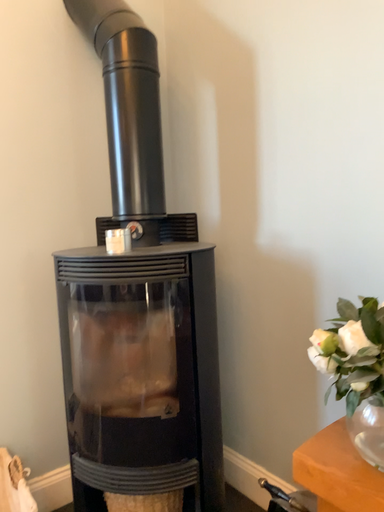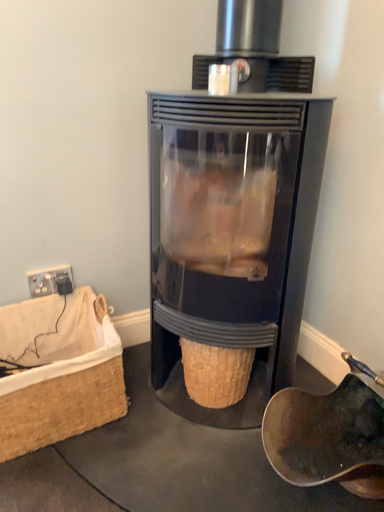
Question: How did the camera likely rotate when shooting the video?

Choices:
 (A) rotated right
 (B) rotated left

Answer: (B)